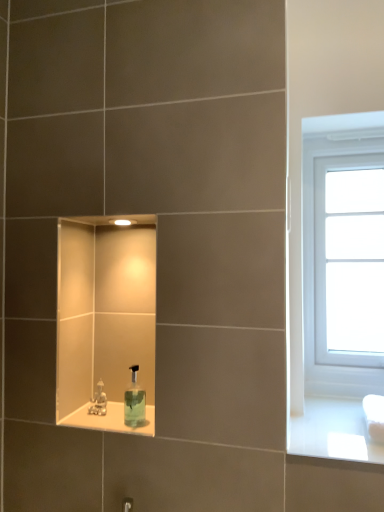
The image size is (384, 512). Describe the element at coordinates (99, 401) in the screenshot. I see `metallic silver faucet at lower center` at that location.

Describe the element at coordinates (134, 401) in the screenshot. I see `transparent plastic soap dispenser at center` at that location.

The height and width of the screenshot is (512, 384). What do you see at coordinates (110, 419) in the screenshot?
I see `clear glass soap dispenser at center` at bounding box center [110, 419].

Find the location of a particular element. metallic silver faucet at lower center is located at coordinates (99, 401).

You are a GUI agent. You are given a task and a screenshot of the screen. Output one action in this format:
    pyautogui.click(x=<x>, y=<y>)
    Task: Click on the window above the metallic silver faucet at lower center (from the image's perspective)
    Image resolution: width=384 pixels, height=512 pixels.
    Given the screenshot: What is the action you would take?
    pyautogui.click(x=343, y=254)

Can you tell me how much white plastic window at right and metallic silver faucet at lower center differ in facing direction?

1.78 degrees separate the facing orientations of white plastic window at right and metallic silver faucet at lower center.

In the image, is white plastic window at right positioned in front of or behind metallic silver faucet at lower center?

Visually, white plastic window at right is located behind metallic silver faucet at lower center.

What's the angular difference between transparent plastic soap dispenser at center and clear glass soap dispenser at center's facing directions?

transparent plastic soap dispenser at center and clear glass soap dispenser at center are facing 0.158 degrees away from each other.

I want to click on window sill lying in front of the transparent plastic soap dispenser at center, so (x=110, y=419).

Is clear glass soap dispenser at center completely or partially inside transparent plastic soap dispenser at center?

No, clear glass soap dispenser at center is not surrounded by transparent plastic soap dispenser at center.

Is transparent plastic soap dispenser at center aimed at clear glass soap dispenser at center?

No.

From a real-world perspective, which object stands above the other?

white plastic window at right, from a real-world perspective.

Is transparent plastic soap dispenser at center surrounding white plastic window at right?

No, white plastic window at right is not surrounded by transparent plastic soap dispenser at center.

Is transparent plastic soap dispenser at center far from white plastic window at right?

No, transparent plastic soap dispenser at center is not far away from white plastic window at right.

Which object is positioned more to the left, metallic silver faucet at lower center or transparent plastic soap dispenser at center?

From the viewer's perspective, metallic silver faucet at lower center appears more on the left side.

From a real-world perspective, is metallic silver faucet at lower center over transparent plastic soap dispenser at center?

No, from a real-world perspective, metallic silver faucet at lower center is not above transparent plastic soap dispenser at center.

Considering the sizes of objects metallic silver faucet at lower center and transparent plastic soap dispenser at center in the image provided, who is smaller, metallic silver faucet at lower center or transparent plastic soap dispenser at center?

metallic silver faucet at lower center.

Is the surface of metallic silver faucet at lower center in direct contact with transparent plastic soap dispenser at center?

Yes, the surface of metallic silver faucet at lower center is in contact with transparent plastic soap dispenser at center.

Which object is more forward, transparent plastic soap dispenser at center or metallic silver faucet at lower center?

transparent plastic soap dispenser at center.

Identify the location of soap dispenser to the right of metallic silver faucet at lower center. This screenshot has width=384, height=512. (134, 401).

Looking at this image, is transparent plastic soap dispenser at center bigger or smaller than metallic silver faucet at lower center?

In the image, transparent plastic soap dispenser at center appears to be larger than metallic silver faucet at lower center.

From a real-world perspective, is metallic silver faucet at lower center physically above clear glass soap dispenser at center?

Indeed, from a real-world perspective, metallic silver faucet at lower center stands above clear glass soap dispenser at center.

In the image, is metallic silver faucet at lower center positioned in front of or behind clear glass soap dispenser at center?

Visually, metallic silver faucet at lower center is located behind clear glass soap dispenser at center.

Can you tell me how much metallic silver faucet at lower center and clear glass soap dispenser at center differ in facing direction?

There is a 1.02-degree angle between the facing directions of metallic silver faucet at lower center and clear glass soap dispenser at center.

Which is behind, point (105, 408) or point (84, 406)?

The point (84, 406) is farther from the camera.

Is transparent plastic soap dispenser at center at the back of clear glass soap dispenser at center?

clear glass soap dispenser at center is not turned away from transparent plastic soap dispenser at center.

Which of these two, clear glass soap dispenser at center or transparent plastic soap dispenser at center, is smaller?

Smaller between the two is clear glass soap dispenser at center.

Looking at this image, which is less distant, (138, 433) or (128, 397)?

Clearly, point (138, 433) is closer to the camera than point (128, 397).

From the image's perspective, would you say clear glass soap dispenser at center is shown under transparent plastic soap dispenser at center?

Indeed, from the image's perspective, clear glass soap dispenser at center is shown beneath transparent plastic soap dispenser at center.

In order to click on tap in front of the white plastic window at right in this screenshot , I will do `click(99, 401)`.

Image resolution: width=384 pixels, height=512 pixels. In order to click on soap dispenser behind the clear glass soap dispenser at center in this screenshot , I will do `click(134, 401)`.

Considering their positions, is clear glass soap dispenser at center positioned closer to metallic silver faucet at lower center than transparent plastic soap dispenser at center?

clear glass soap dispenser at center lies closer to metallic silver faucet at lower center than the other object.

Consider the image. When comparing their distances from transparent plastic soap dispenser at center, does metallic silver faucet at lower center or clear glass soap dispenser at center seem closer?

Among the two, clear glass soap dispenser at center is located nearer to transparent plastic soap dispenser at center.

Looking at the image, which one is located further to clear glass soap dispenser at center, transparent plastic soap dispenser at center or white plastic window at right?

white plastic window at right is positioned further to the anchor clear glass soap dispenser at center.

Based on the photo, looking at the image, which one is located closer to white plastic window at right, metallic silver faucet at lower center or clear glass soap dispenser at center?

The object closer to white plastic window at right is clear glass soap dispenser at center.

When comparing their distances from clear glass soap dispenser at center, does white plastic window at right or metallic silver faucet at lower center seem further?

Based on the image, white plastic window at right appears to be further to clear glass soap dispenser at center.

Based on their spatial positions, is white plastic window at right or metallic silver faucet at lower center closer to transparent plastic soap dispenser at center?

metallic silver faucet at lower center is positioned closer to the anchor transparent plastic soap dispenser at center.

Which object lies nearer to the anchor point transparent plastic soap dispenser at center, white plastic window at right or clear glass soap dispenser at center?

clear glass soap dispenser at center.

Looking at the image, which one is located closer to clear glass soap dispenser at center, metallic silver faucet at lower center or transparent plastic soap dispenser at center?

metallic silver faucet at lower center.

At what (x,y) coordinates should I click in order to perform the action: click on window sill between metallic silver faucet at lower center and white plastic window at right in the horizontal direction. Please return your answer as a coordinate pair (x, y). This screenshot has width=384, height=512. Looking at the image, I should click on (110, 419).

What are the coordinates of `soap dispenser between metallic silver faucet at lower center and white plastic window at right from left to right` in the screenshot? It's located at (134, 401).

At what (x,y) coordinates should I click in order to perform the action: click on soap dispenser between clear glass soap dispenser at center and white plastic window at right in the horizontal direction. Please return your answer as a coordinate pair (x, y). This screenshot has height=512, width=384. Looking at the image, I should click on (134, 401).

Where is `soap dispenser located between clear glass soap dispenser at center and metallic silver faucet at lower center in the depth direction`? The height and width of the screenshot is (512, 384). soap dispenser located between clear glass soap dispenser at center and metallic silver faucet at lower center in the depth direction is located at coordinates (134, 401).